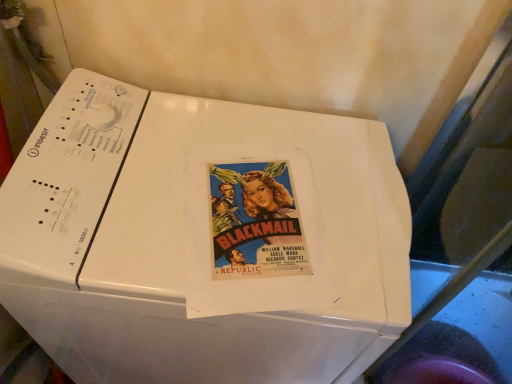
The width and height of the screenshot is (512, 384). What do you see at coordinates (185, 241) in the screenshot?
I see `white plastic washing machine at center` at bounding box center [185, 241].

What is the approximate width of white plastic washing machine at center?

The width of white plastic washing machine at center is 16.57 inches.

Identify the location of white plastic washing machine at center. Image resolution: width=512 pixels, height=384 pixels. (185, 241).

This screenshot has width=512, height=384. In order to click on white plastic washing machine at center in this screenshot , I will do `click(185, 241)`.